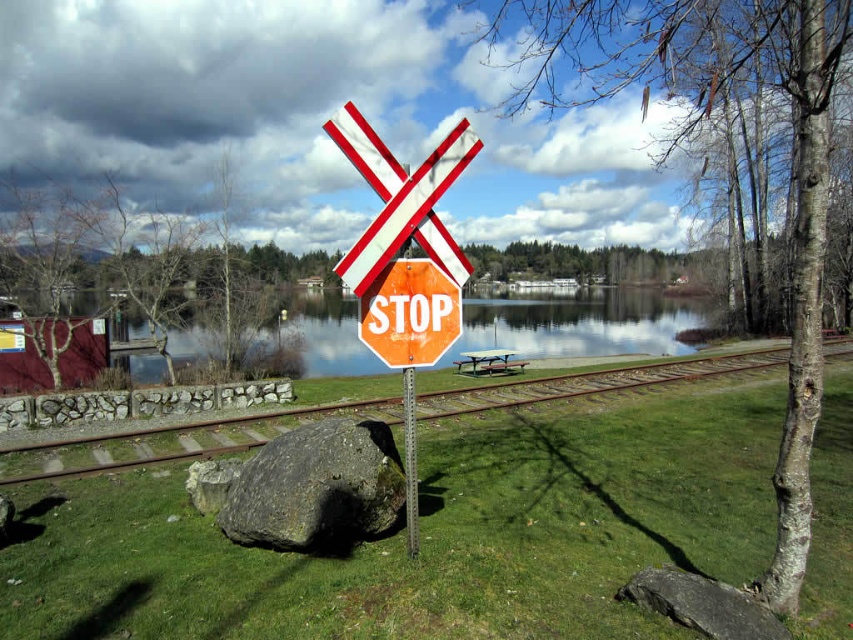
You are standing at the railway crossing and see the orange reflective stop sign at center. If you walk directly towards the sign, will you be facing the railway tracks or the picnic table?

The orange reflective stop sign at center is located at point [407,182], which is in the foreground near the railway tracks. Therefore, walking directly towards it would mean facing the railway tracks.

You are standing at the railway crossing and see the glossy reflective water at center. If you walk straight towards the water, will you reach it before the railway tracks?

Yes, because the glossy reflective water at center is located at point (582,324), which is closer to your current position than the railway tracks.